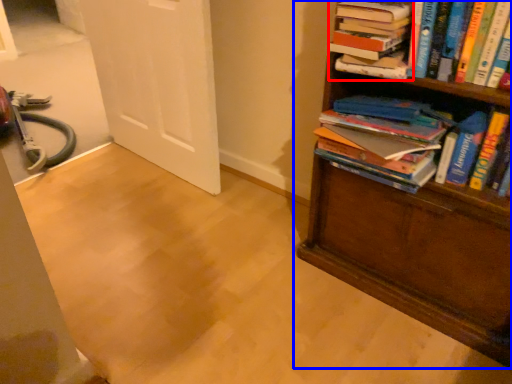
Question: Which of the following is the farthest to the observer, book (highlighted by a red box) or bookcase (highlighted by a blue box)?

Choices:
 (A) book
 (B) bookcase

Answer: (A)